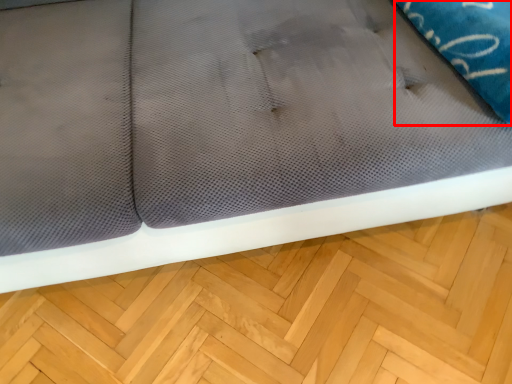
Question: In this image, where is pillow (annotated by the red box) located relative to hardwood?

Choices:
 (A) left
 (B) right

Answer: (B)